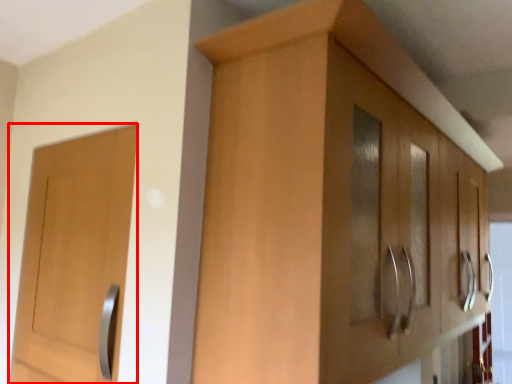
Question: From the image's perspective, what is the correct spatial positioning of door (annotated by the red box) in reference to cabinetry?

Choices:
 (A) above
 (B) below

Answer: (B)